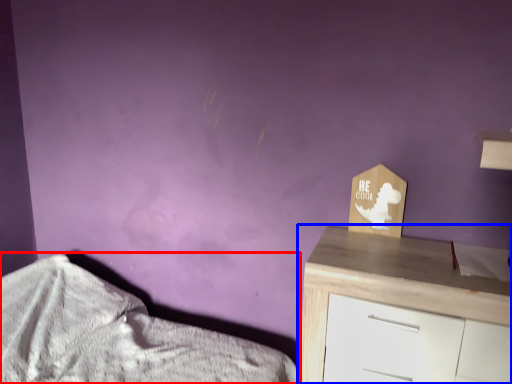
Question: Among these objects, which one is nearest to the camera, bed (highlighted by a red box) or chest of drawers (highlighted by a blue box)?

Choices:
 (A) bed
 (B) chest of drawers

Answer: (A)